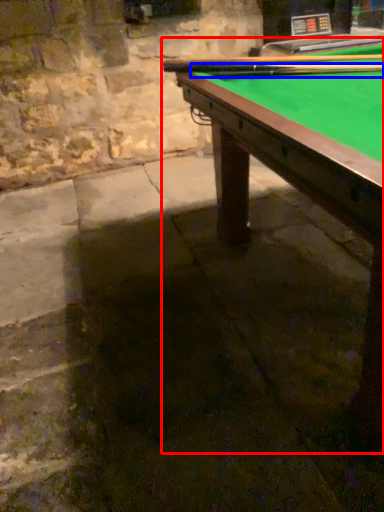
Question: Which of the following is the closest to the observer, billiard table (highlighted by a red box) or cue (highlighted by a blue box)?

Choices:
 (A) billiard table
 (B) cue

Answer: (A)